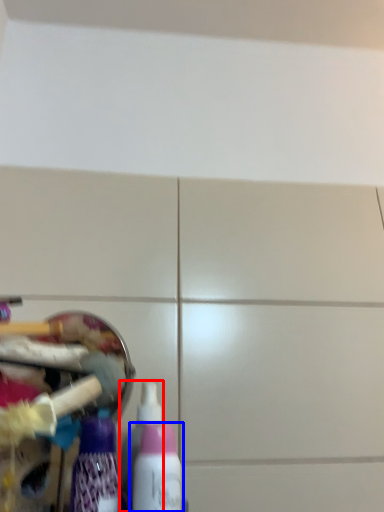
Question: Which of the following is the farthest to the observer, bottle (highlighted by a red box) or bottle (highlighted by a blue box)?

Choices:
 (A) bottle
 (B) bottle

Answer: (A)